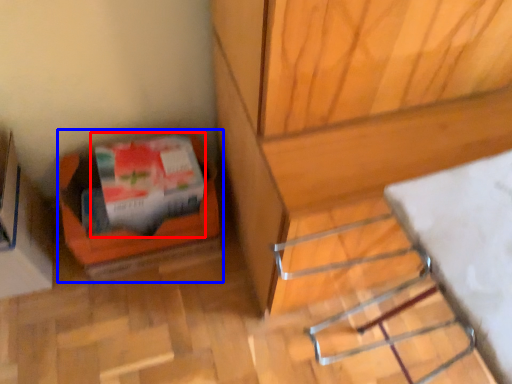
Question: Which object is closer to the camera taking this photo, wrapping paper (highlighted by a red box) or box (highlighted by a blue box)?

Choices:
 (A) wrapping paper
 (B) box

Answer: (A)